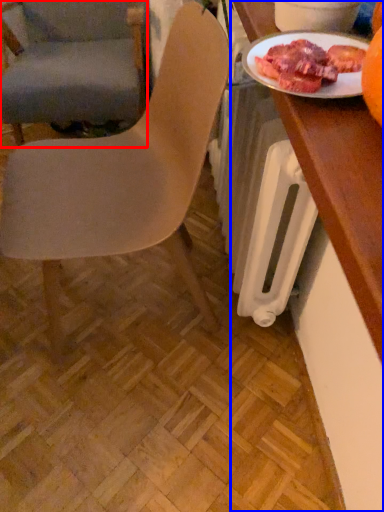
Question: Which object appears farthest to the camera in this image, chair (highlighted by a red box) or desk (highlighted by a blue box)?

Choices:
 (A) chair
 (B) desk

Answer: (A)